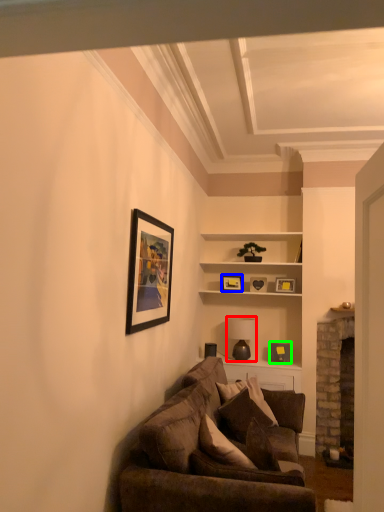
Question: Which is nearer to the lamp (highlighted by a red box)? picture frame (highlighted by a blue box) or picture frame (highlighted by a green box).

Choices:
 (A) picture frame
 (B) picture frame

Answer: (B)